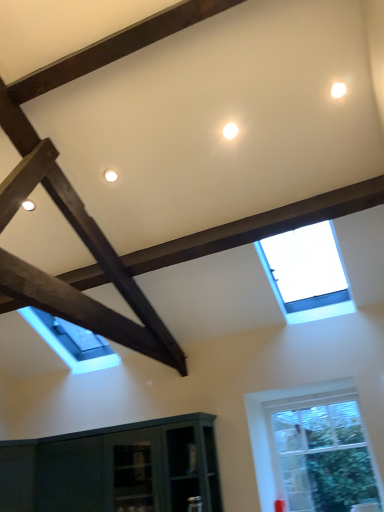
Question: From a real-world perspective, is transparent glass skylight at upper center, the 1th window from the top, physically below clear glass window at lower right, the second window in the top-to-bottom sequence?

Choices:
 (A) no
 (B) yes

Answer: (A)

Question: From a real-world perspective, is transparent glass skylight at upper center, which is the second window in bottom-to-top order, over clear glass window at lower right, the second window in the top-to-bottom sequence?

Choices:
 (A) no
 (B) yes

Answer: (B)

Question: Is transparent glass skylight at upper center, which is the second window in bottom-to-top order, to the left of clear glass window at lower right, the second window in the top-to-bottom sequence, from the viewer's perspective?

Choices:
 (A) yes
 (B) no

Answer: (A)

Question: Is transparent glass skylight at upper center, which is the second window in bottom-to-top order, in front of clear glass window at lower right, the second window in the top-to-bottom sequence?

Choices:
 (A) yes
 (B) no

Answer: (A)

Question: Considering the relative sizes of transparent glass skylight at upper center, the 1th window from the top, and clear glass window at lower right, the second window in the top-to-bottom sequence, in the image provided, is transparent glass skylight at upper center, the 1th window from the top, smaller than clear glass window at lower right, the second window in the top-to-bottom sequence,?

Choices:
 (A) yes
 (B) no

Answer: (B)

Question: Is transparent glass skylight at upper center, which is the second window in bottom-to-top order, facing towards clear glass window at lower right, which is the 1th window in bottom-to-top order?

Choices:
 (A) yes
 (B) no

Answer: (B)

Question: Is clear glass window at lower right, the second window in the top-to-bottom sequence, aimed at transparent glass skylight at upper center, which is the second window in bottom-to-top order?

Choices:
 (A) no
 (B) yes

Answer: (A)

Question: Considering the relative positions of clear glass window at lower right, which is the 1th window in bottom-to-top order, and transparent glass skylight at upper center, the 1th window from the top, in the image provided, is clear glass window at lower right, which is the 1th window in bottom-to-top order, behind transparent glass skylight at upper center, the 1th window from the top,?

Choices:
 (A) no
 (B) yes

Answer: (B)

Question: Considering the relative sizes of clear glass window at lower right, which is the 1th window in bottom-to-top order, and transparent glass skylight at upper center, the 1th window from the top, in the image provided, is clear glass window at lower right, which is the 1th window in bottom-to-top order, wider than transparent glass skylight at upper center, the 1th window from the top,?

Choices:
 (A) no
 (B) yes

Answer: (A)

Question: Is clear glass window at lower right, which is the 1th window in bottom-to-top order, in front of transparent glass skylight at upper center, which is the second window in bottom-to-top order?

Choices:
 (A) no
 (B) yes

Answer: (A)

Question: From the image's perspective, does clear glass window at lower right, the second window in the top-to-bottom sequence, appear lower than transparent glass skylight at upper center, which is the second window in bottom-to-top order?

Choices:
 (A) no
 (B) yes

Answer: (B)

Question: From a real-world perspective, is clear glass window at lower right, which is the 1th window in bottom-to-top order, under transparent glass skylight at upper center, the 1th window from the top?

Choices:
 (A) yes
 (B) no

Answer: (A)

Question: Is clear glass window at lower right, which is the 1th window in bottom-to-top order, in front of or behind transparent glass skylight at upper center, the 1th window from the top, in the image?

Choices:
 (A) front
 (B) behind

Answer: (B)